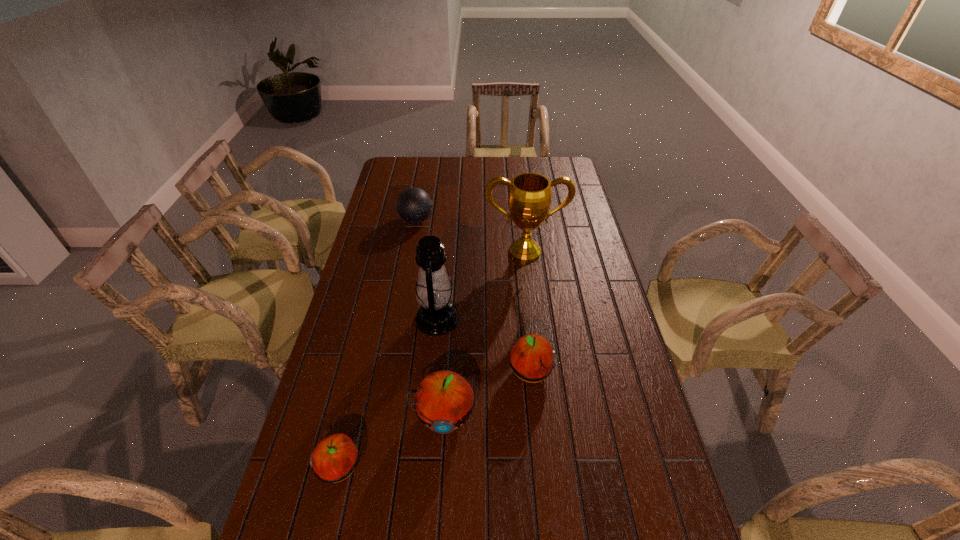
Find the location of a particular element. The height and width of the screenshot is (540, 960). free location located on the grip area of the farthest object is located at coordinates (505, 220).

Locate an element on the screen. free space located on the back of the oil lamp is located at coordinates (444, 253).

I want to click on vacant space located 0.230m on the front-facing side of the award, so click(532, 309).

Locate an element on the screen. The height and width of the screenshot is (540, 960). apple positioned at the left edge is located at coordinates (335, 457).

Where is `bowling ball positioned at the left edge`? This screenshot has height=540, width=960. bowling ball positioned at the left edge is located at coordinates (414, 205).

In order to click on object situated at the right edge in this screenshot , I will do `click(529, 200)`.

Find the location of a particular element. This screenshot has width=960, height=540. vacant position at the near edge of the desktop is located at coordinates (509, 529).

This screenshot has width=960, height=540. In order to click on free space at the left edge in this screenshot , I will do `click(348, 339)`.

Identify the location of free region at the right edge of the desktop. (669, 474).

The height and width of the screenshot is (540, 960). In order to click on free space at the far left corner in this screenshot , I will do `click(389, 179)`.